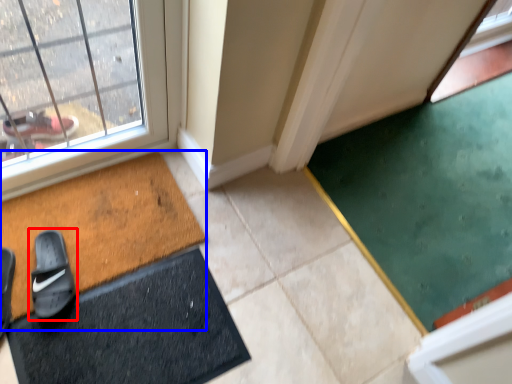
Question: Which object is further to the camera taking this photo, footwear (highlighted by a red box) or bath mat (highlighted by a blue box)?

Choices:
 (A) footwear
 (B) bath mat

Answer: (A)